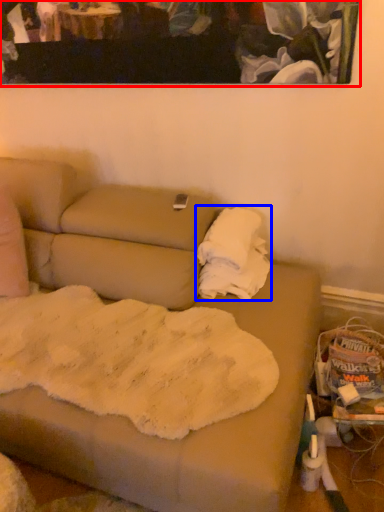
Question: Among these objects, which one is nearest to the camera, picture frame (highlighted by a red box) or cloth (highlighted by a blue box)?

Choices:
 (A) picture frame
 (B) cloth

Answer: (A)